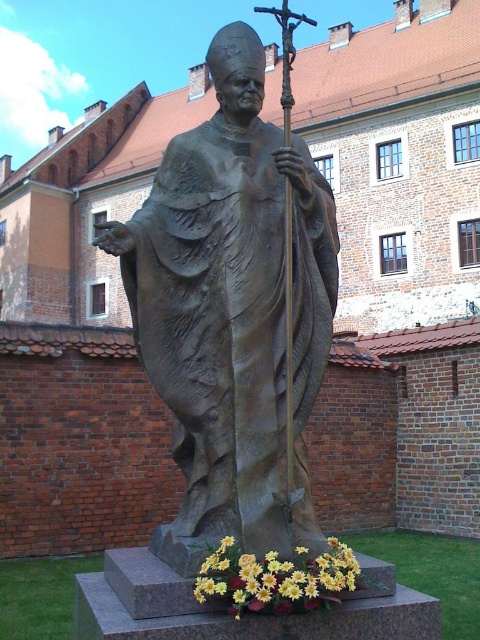
You are standing in front of the bronze statue at center. If you want to place a small bouquet of flowers exactly 0.5 meters to the right of the statue, where should you position it relative to the statue?

The bronze statue at center is located at point [231,312]. To place the bouquet 0.5 meters to the right, position it slightly to the right side of the statue.

You are standing in front of the statue and want to take a photo. There are two points marked on the statue base, one at point (x=212, y=275) and the other at point (x=327, y=596). Which point is closer to your camera lens?

Point (x=212, y=275) is further to the camera than point (x=327, y=596), so the point closer to your camera lens is point (x=327, y=596).